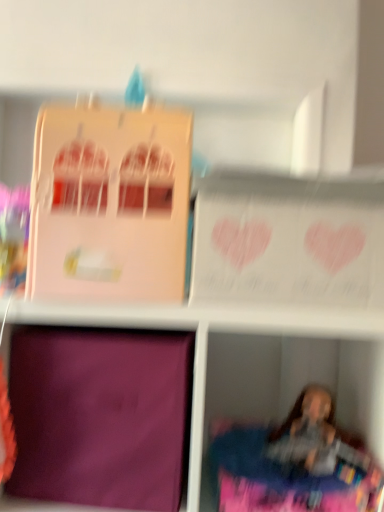
Question: Is pink matte cardboard box at upper left, the 1th cardboard box positioned from the top, far from purple matte cardboard box at lower left, the 1th cardboard box from the bottom?

Choices:
 (A) yes
 (B) no

Answer: (B)

Question: Is pink matte cardboard box at upper left, which is counted as the second cardboard box, starting from the bottom, positioned behind purple matte cardboard box at lower left, the 2th cardboard box when ordered from top to bottom?

Choices:
 (A) no
 (B) yes

Answer: (A)

Question: Does pink matte cardboard box at upper left, which is counted as the second cardboard box, starting from the bottom, have a greater width compared to purple matte cardboard box at lower left, the 2th cardboard box when ordered from top to bottom?

Choices:
 (A) yes
 (B) no

Answer: (B)

Question: Can you confirm if pink matte cardboard box at upper left, the 1th cardboard box positioned from the top, is taller than purple matte cardboard box at lower left, the 1th cardboard box from the bottom?

Choices:
 (A) no
 (B) yes

Answer: (B)

Question: From a real-world perspective, is pink matte cardboard box at upper left, which is counted as the second cardboard box, starting from the bottom, located higher than purple matte cardboard box at lower left, the 1th cardboard box from the bottom?

Choices:
 (A) no
 (B) yes

Answer: (B)

Question: Is purple matte cardboard box at lower left, the 2th cardboard box when ordered from top to bottom, inside pink matte cardboard box at upper left, which is counted as the second cardboard box, starting from the bottom?

Choices:
 (A) no
 (B) yes

Answer: (A)

Question: Considering the relative sizes of purple matte cardboard box at lower left, the 1th cardboard box from the bottom, and pink matte cardboard box at upper left, which is counted as the second cardboard box, starting from the bottom, in the image provided, is purple matte cardboard box at lower left, the 1th cardboard box from the bottom, smaller than pink matte cardboard box at upper left, which is counted as the second cardboard box, starting from the bottom,?

Choices:
 (A) yes
 (B) no

Answer: (B)

Question: Considering the relative sizes of purple matte cardboard box at lower left, the 1th cardboard box from the bottom, and pink matte cardboard box at upper left, which is counted as the second cardboard box, starting from the bottom, in the image provided, is purple matte cardboard box at lower left, the 1th cardboard box from the bottom, shorter than pink matte cardboard box at upper left, which is counted as the second cardboard box, starting from the bottom,?

Choices:
 (A) no
 (B) yes

Answer: (B)

Question: Does purple matte cardboard box at lower left, the 1th cardboard box from the bottom, have a lesser width compared to pink matte cardboard box at upper left, which is counted as the second cardboard box, starting from the bottom?

Choices:
 (A) no
 (B) yes

Answer: (A)

Question: Does purple matte cardboard box at lower left, the 2th cardboard box when ordered from top to bottom, have a larger size compared to pink matte cardboard box at upper left, the 1th cardboard box positioned from the top?

Choices:
 (A) no
 (B) yes

Answer: (B)

Question: Would you say pink matte cardboard box at upper left, which is counted as the second cardboard box, starting from the bottom, is part of purple matte cardboard box at lower left, the 1th cardboard box from the bottom,'s contents?

Choices:
 (A) yes
 (B) no

Answer: (B)

Question: From the image's perspective, is purple matte cardboard box at lower left, the 1th cardboard box from the bottom, below pink matte cardboard box at upper left, the 1th cardboard box positioned from the top?

Choices:
 (A) no
 (B) yes

Answer: (B)

Question: Is purple fabric at lower left thinner than pink matte cardboard box at upper left, which is counted as the second cardboard box, starting from the bottom?

Choices:
 (A) no
 (B) yes

Answer: (A)